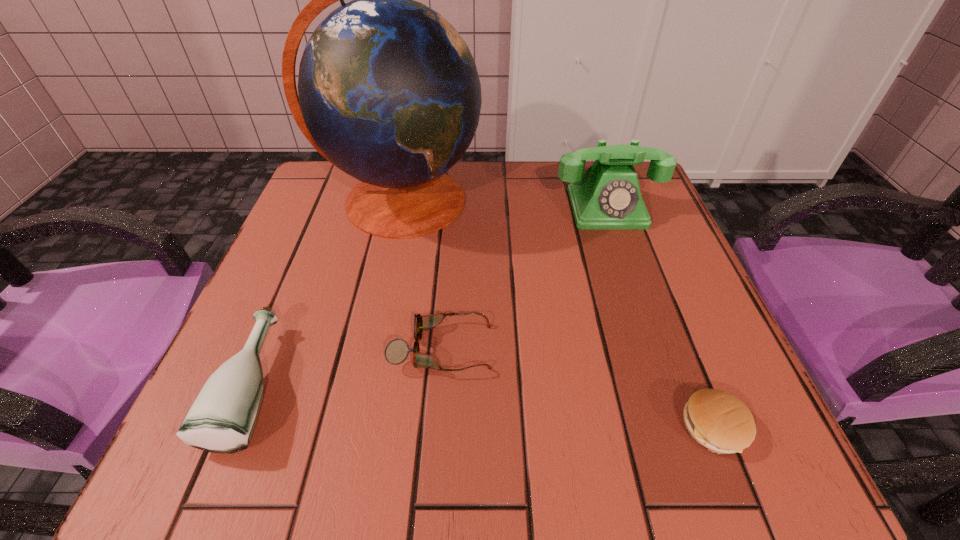
Image resolution: width=960 pixels, height=540 pixels. I want to click on globe at the far edge, so click(389, 93).

At what (x,y) coordinates should I click in order to perform the action: click on telephone at the far edge. Please return your answer as a coordinate pair (x, y). Looking at the image, I should click on (607, 196).

Identify the location of bottle located in the near edge section of the desktop. The width and height of the screenshot is (960, 540). (222, 418).

In order to click on patty that is at the near edge in this screenshot , I will do `click(717, 420)`.

Where is `globe that is at the left edge`? globe that is at the left edge is located at coordinates (389, 93).

Where is `bottle that is at the left edge`? bottle that is at the left edge is located at coordinates pos(222,418).

Where is `telephone that is at the right edge`? Image resolution: width=960 pixels, height=540 pixels. telephone that is at the right edge is located at coordinates point(607,196).

Identify the location of patty located in the right edge section of the desktop. The height and width of the screenshot is (540, 960). (717, 420).

The width and height of the screenshot is (960, 540). I want to click on object present at the far left corner, so click(389, 93).

Locate an element on the screen. Image resolution: width=960 pixels, height=540 pixels. object located in the near left corner section of the desktop is located at coordinates (x=222, y=418).